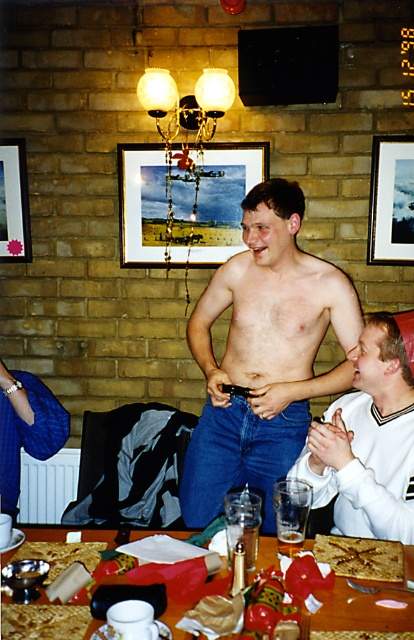
Can you confirm if denim jeans at center is wider than smooth white shirt at center?

Yes.

Who is higher up, denim jeans at center or smooth white shirt at center?

Positioned higher is denim jeans at center.

The height and width of the screenshot is (640, 414). Find the location of `denim jeans at center`. denim jeans at center is located at coordinates (264, 355).

Is smooth white shirt at center taller than wooden picture frame at upper left?

Indeed, smooth white shirt at center has a greater height compared to wooden picture frame at upper left.

The width and height of the screenshot is (414, 640). I want to click on smooth white shirt at center, so click(368, 442).

Can you confirm if wooden framed picture at center is taller than wooden textured table at center?

Indeed, wooden framed picture at center has a greater height compared to wooden textured table at center.

Between wooden framed picture at center and wooden textured table at center, which one is positioned higher?

wooden framed picture at center is higher up.

Which is in front, point (161, 163) or point (343, 580)?

Point (343, 580) is in front.

The width and height of the screenshot is (414, 640). Find the location of `wooden framed picture at center`. wooden framed picture at center is located at coordinates (224, 198).